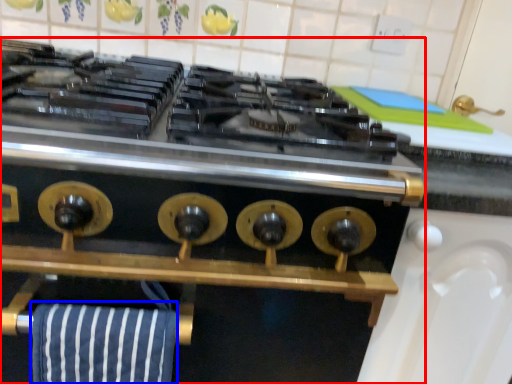
Question: Which object is closer to the camera taking this photo, kitchen appliance (highlighted by a red box) or beach towel (highlighted by a blue box)?

Choices:
 (A) kitchen appliance
 (B) beach towel

Answer: (A)